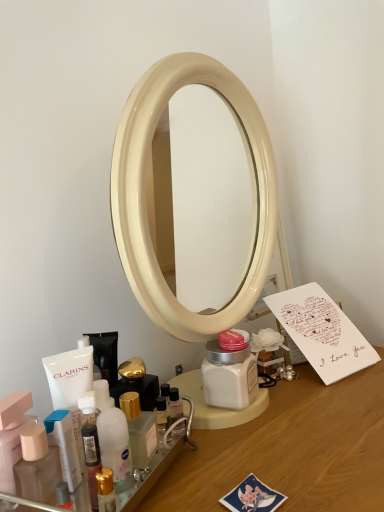
Question: Is the position of wooden desk at center more distant than that of white paper card at right?

Choices:
 (A) yes
 (B) no

Answer: (B)

Question: Is wooden desk at center far from white paper card at right?

Choices:
 (A) yes
 (B) no

Answer: (B)

Question: From a real-world perspective, is wooden desk at center below white paper card at right?

Choices:
 (A) no
 (B) yes

Answer: (B)

Question: Can you confirm if wooden desk at center is smaller than white paper card at right?

Choices:
 (A) yes
 (B) no

Answer: (B)

Question: Can you confirm if wooden desk at center is bigger than white paper card at right?

Choices:
 (A) no
 (B) yes

Answer: (B)

Question: Would you say matte plastic bottle at lower left, which is the second toiletry from left to right, is to the left or to the right of matte pink container at lower left, marked as the 1th toiletry in a left-to-right arrangement, in the picture?

Choices:
 (A) right
 (B) left

Answer: (A)

Question: Is matte plastic bottle at lower left, which is counted as the second toiletry, starting from the right, situated inside matte pink container at lower left, placed as the 3th toiletry when sorted from right to left, or outside?

Choices:
 (A) inside
 (B) outside

Answer: (B)

Question: From a real-world perspective, is matte plastic bottle at lower left, which is counted as the second toiletry, starting from the right, above or below matte pink container at lower left, placed as the 3th toiletry when sorted from right to left?

Choices:
 (A) above
 (B) below

Answer: (B)

Question: Relative to matte pink container at lower left, placed as the 3th toiletry when sorted from right to left, is matte plastic bottle at lower left, which is the second toiletry from left to right, in front or behind?

Choices:
 (A) behind
 (B) front

Answer: (B)

Question: Is wooden desk at center in front of or behind translucent plastic bottle at lower left, which appears as the first toiletry when viewed from the right, in the image?

Choices:
 (A) behind
 (B) front

Answer: (B)

Question: Based on their sizes in the image, would you say wooden desk at center is bigger or smaller than translucent plastic bottle at lower left, acting as the 3th toiletry starting from the left?

Choices:
 (A) small
 (B) big

Answer: (B)

Question: Does point (342, 436) appear closer or farther from the camera than point (168, 452)?

Choices:
 (A) closer
 (B) farther

Answer: (B)

Question: In terms of width, does wooden desk at center look wider or thinner when compared to translucent plastic bottle at lower left, acting as the 3th toiletry starting from the left?

Choices:
 (A) wide
 (B) thin

Answer: (A)

Question: From the image's perspective, is matte pink container at lower left, marked as the 1th toiletry in a left-to-right arrangement, positioned above or below translucent plastic bottle at lower left, acting as the 3th toiletry starting from the left?

Choices:
 (A) below
 (B) above

Answer: (B)

Question: Based on their positions, is matte pink container at lower left, marked as the 1th toiletry in a left-to-right arrangement, located to the left or right of translucent plastic bottle at lower left, which appears as the first toiletry when viewed from the right?

Choices:
 (A) left
 (B) right

Answer: (A)